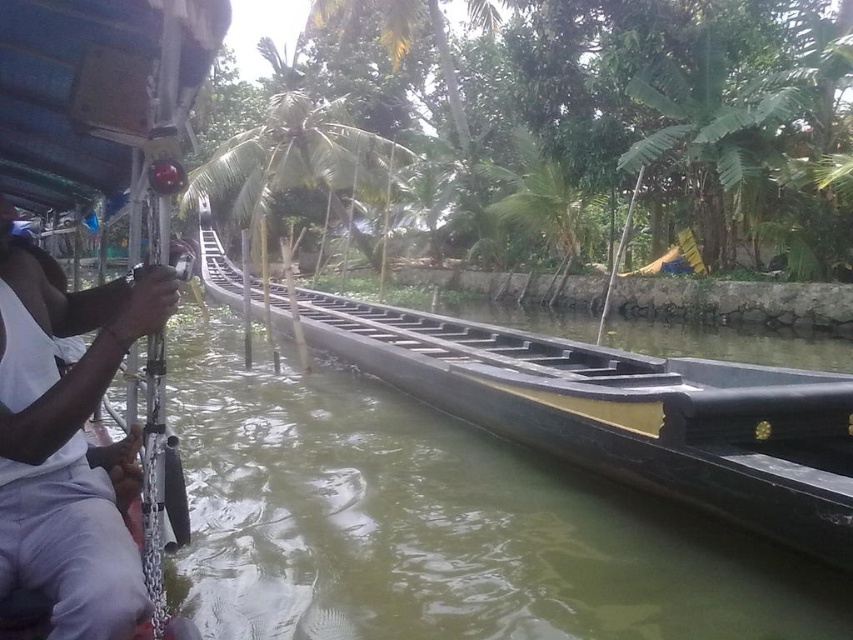
Question: From the image, what is the correct spatial relationship of black matte boat at center in relation to white fabric shirt at left?

Choices:
 (A) right
 (B) left

Answer: (B)

Question: Is black matte boat at center wider than white fabric shirt at left?

Choices:
 (A) no
 (B) yes

Answer: (B)

Question: Does black matte boat at center have a smaller size compared to white fabric shirt at left?

Choices:
 (A) yes
 (B) no

Answer: (B)

Question: Which of the following is the farthest from the observer?

Choices:
 (A) white fabric shirt at left
 (B) black matte boat at center

Answer: (B)